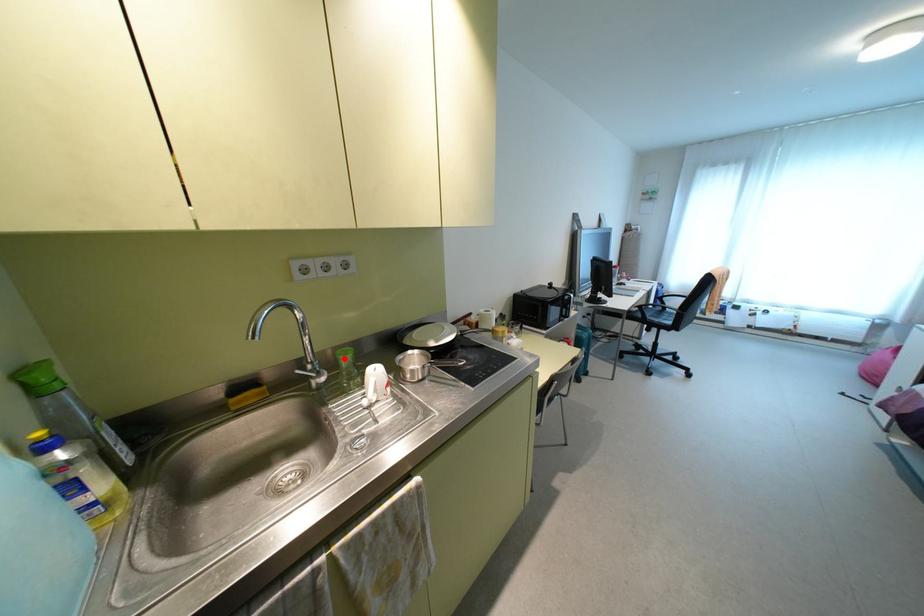
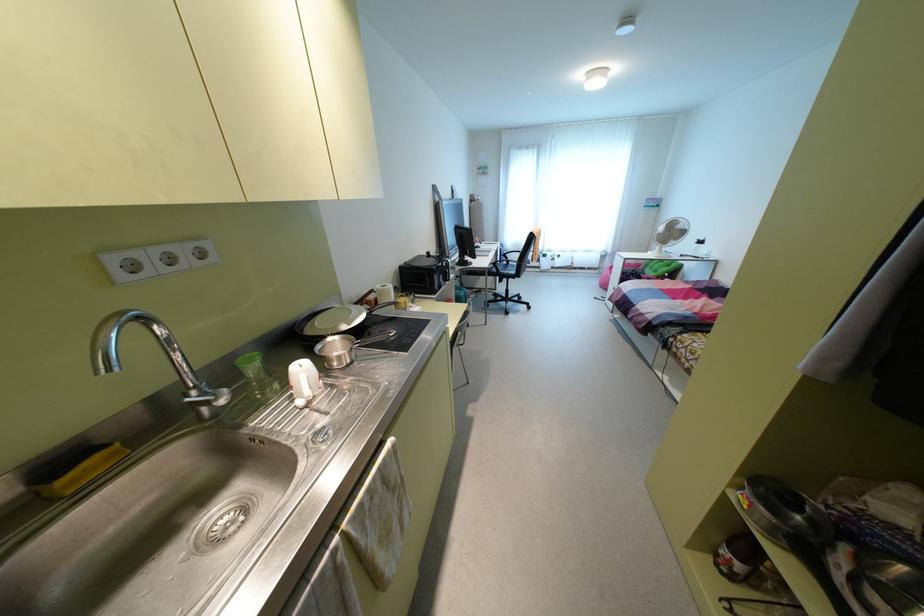
Find the pixel in the second image that matches the highlighted location in the first image.

(251, 366)